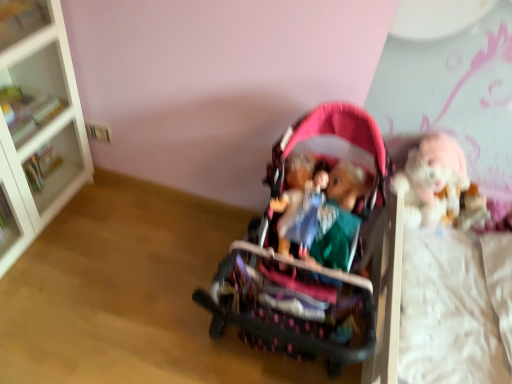
In order to click on vacant area situated to the left side of pink fabric stroller at center in this screenshot , I will do `click(133, 294)`.